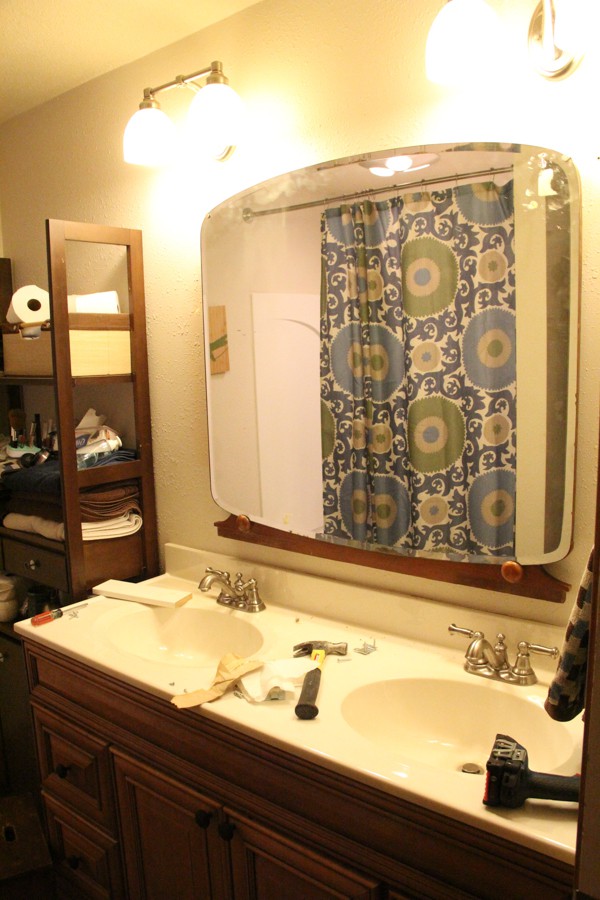
At what (x,y) coordinates should I click in order to perform the action: click on drawers. Please return your answer as a coordinate pair (x, y). The width and height of the screenshot is (600, 900). Looking at the image, I should click on (81, 775), (91, 847).